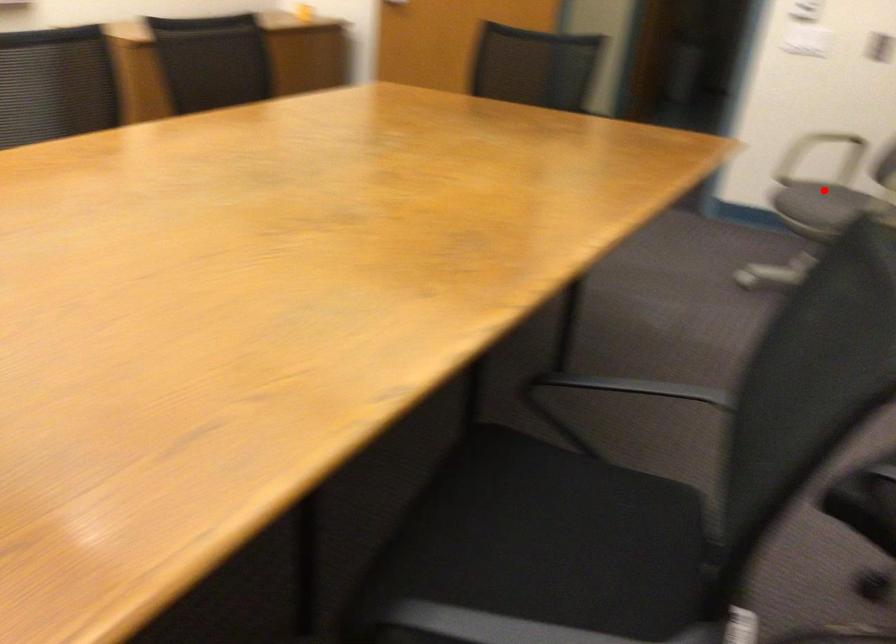
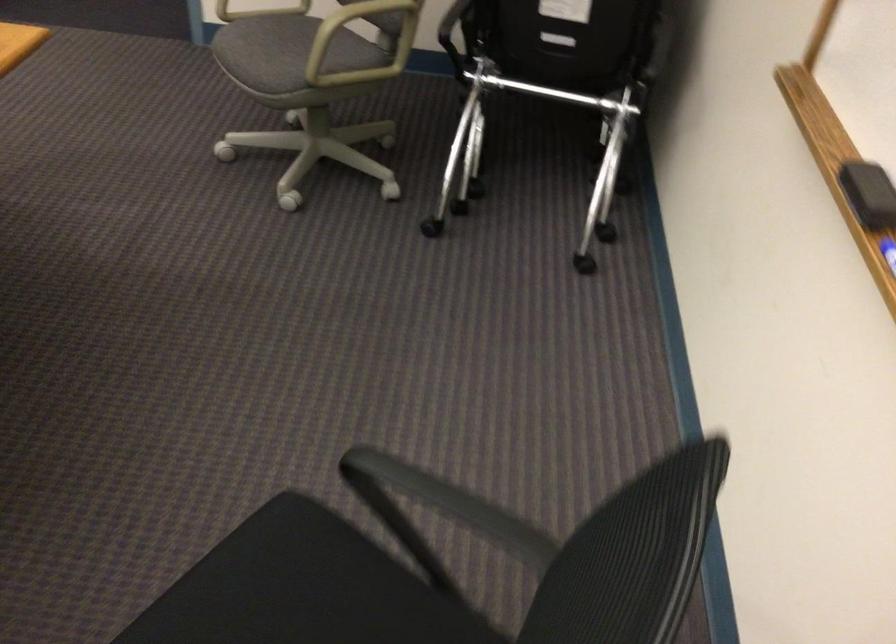
In the second image, find the point that corresponds to the highlighted location in the first image.

(286, 42)